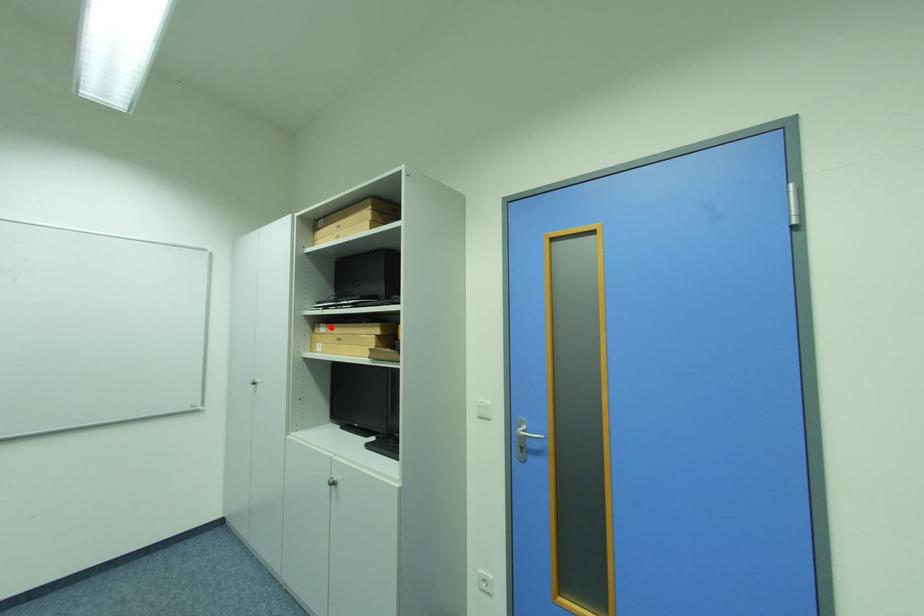
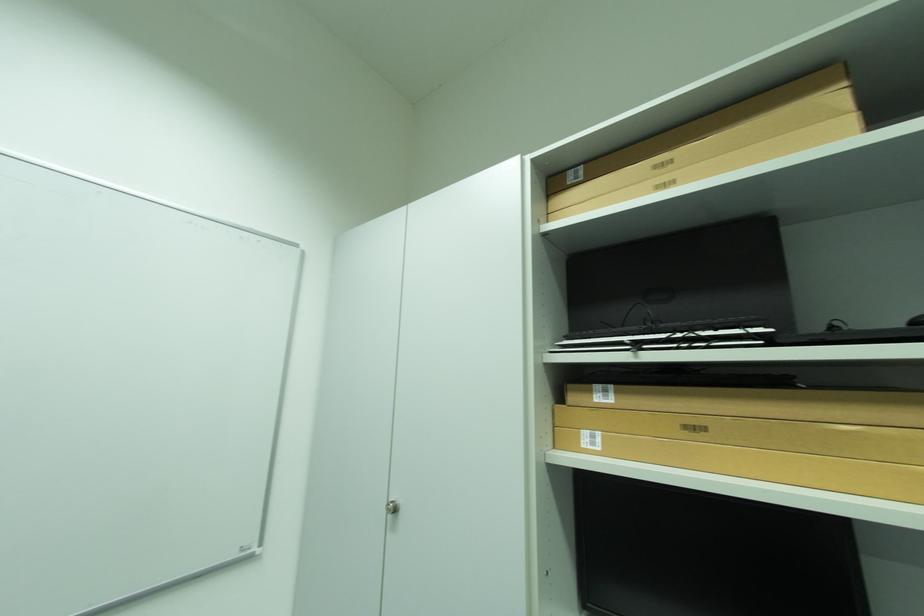
The point at the highlighted location is marked in the first image. Where is the corresponding point in the second image?

(614, 392)